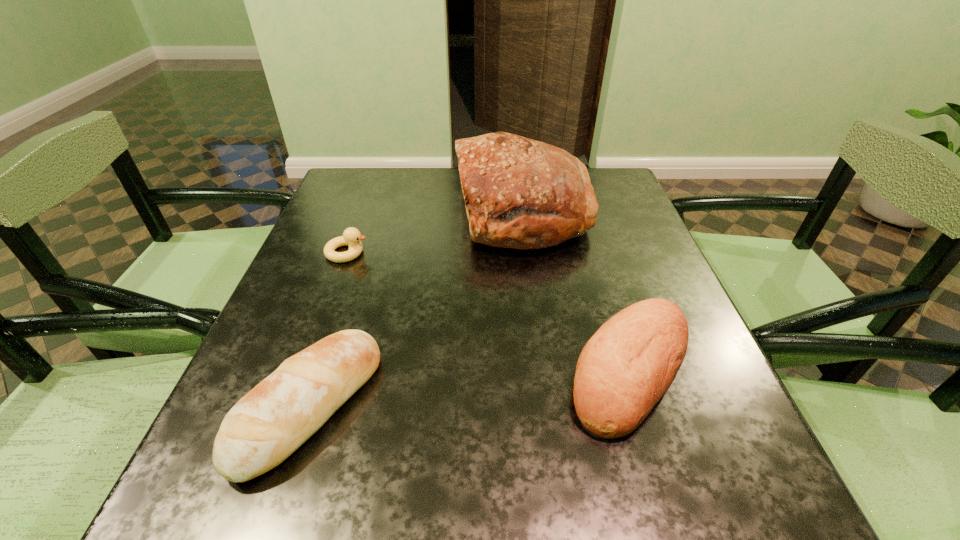
In the image, there is a desktop. Where is `vacant area at the far right corner`? The height and width of the screenshot is (540, 960). vacant area at the far right corner is located at coordinates (609, 199).

You are a GUI agent. You are given a task and a screenshot of the screen. Output one action in this format:
    pyautogui.click(x=<x>, y=<y>)
    Task: Click on the free point at the near right corner
    This screenshot has width=960, height=540.
    Given the screenshot: What is the action you would take?
    pyautogui.click(x=679, y=494)

Find the location of a particular element. vacant region between the leftmost bread and the shortest object is located at coordinates (328, 329).

This screenshot has width=960, height=540. Find the location of `free point between the duckling and the tallest bread`. free point between the duckling and the tallest bread is located at coordinates (435, 232).

The width and height of the screenshot is (960, 540). Find the location of `free area in between the farthest bread and the shortest object`. free area in between the farthest bread and the shortest object is located at coordinates (435, 232).

This screenshot has height=540, width=960. In order to click on vacant space in between the duckling and the tallest object in this screenshot , I will do `click(435, 232)`.

Where is `object that ranks as the third closest to the leftmost bread`? Image resolution: width=960 pixels, height=540 pixels. object that ranks as the third closest to the leftmost bread is located at coordinates (626, 367).

Locate an element on the screen. object that ranks as the second closest to the shortest object is located at coordinates (277, 416).

Find the location of a particular element. The height and width of the screenshot is (540, 960). bread that stands as the third closest to the duckling is located at coordinates (626, 367).

Where is `the closest bread to the leftmost bread`? Image resolution: width=960 pixels, height=540 pixels. the closest bread to the leftmost bread is located at coordinates (520, 193).